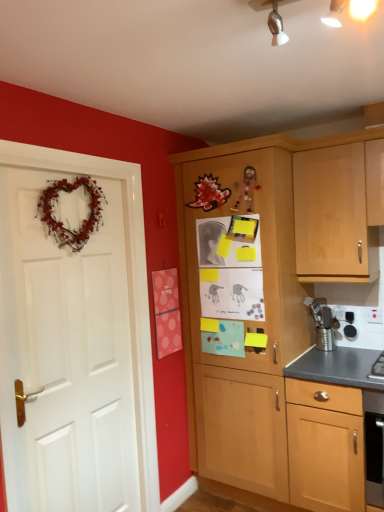
Question: Does metallic silver utensil holder at right have a lesser height compared to white matte door at left?

Choices:
 (A) no
 (B) yes

Answer: (B)

Question: From the image's perspective, is metallic silver utensil holder at right above white matte door at left?

Choices:
 (A) no
 (B) yes

Answer: (B)

Question: Is metallic silver utensil holder at right closer to camera compared to white matte door at left?

Choices:
 (A) no
 (B) yes

Answer: (A)

Question: Would you consider metallic silver utensil holder at right to be distant from white matte door at left?

Choices:
 (A) yes
 (B) no

Answer: (A)

Question: Would you say metallic silver utensil holder at right is outside white matte door at left?

Choices:
 (A) no
 (B) yes

Answer: (B)

Question: Is metallic silver utensil holder at right situated inside wooden cabinet at center or outside?

Choices:
 (A) inside
 (B) outside

Answer: (A)

Question: Is metallic silver utensil holder at right to the left or to the right of wooden cabinet at center in the image?

Choices:
 (A) left
 (B) right

Answer: (B)

Question: In terms of height, does metallic silver utensil holder at right look taller or shorter compared to wooden cabinet at center?

Choices:
 (A) tall
 (B) short

Answer: (B)

Question: Is point (326, 343) positioned closer to the camera than point (357, 207)?

Choices:
 (A) closer
 (B) farther

Answer: (B)

Question: From a real-world perspective, relative to white matte door at left, is metallic silver utensil holder at right vertically above or below?

Choices:
 (A) below
 (B) above

Answer: (A)

Question: Based on their sizes in the image, would you say metallic silver utensil holder at right is bigger or smaller than white matte door at left?

Choices:
 (A) big
 (B) small

Answer: (B)

Question: In the image, is metallic silver utensil holder at right positioned in front of or behind white matte door at left?

Choices:
 (A) behind
 (B) front

Answer: (A)

Question: Is point (329, 337) closer or farther from the camera than point (79, 312)?

Choices:
 (A) closer
 (B) farther

Answer: (B)

Question: Is point (173, 307) positioned closer to the camera than point (322, 338)?

Choices:
 (A) farther
 (B) closer

Answer: (A)

Question: From the image's perspective, is pink polka dot postcard at center located above or below metallic silver utensil holder at right?

Choices:
 (A) below
 (B) above

Answer: (B)